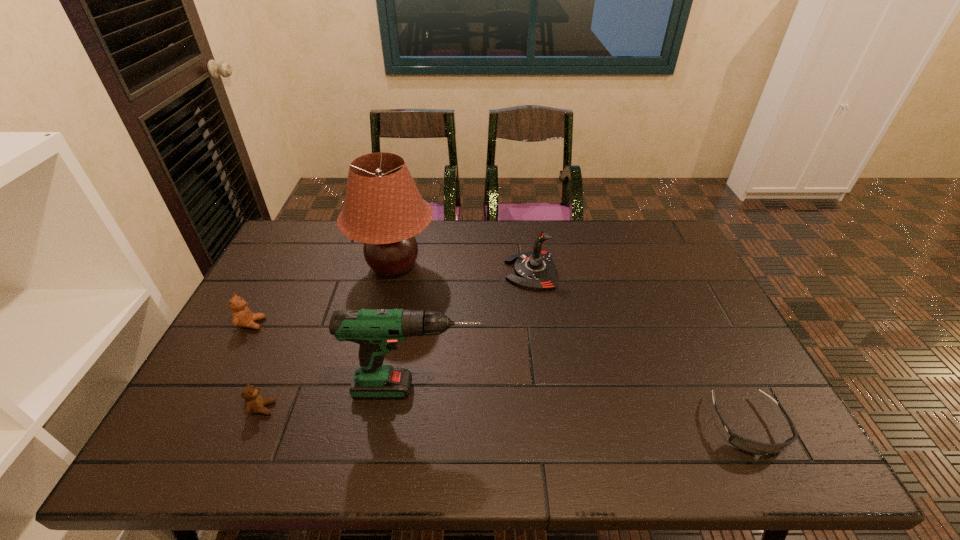
I want to click on object located in the right edge section of the desktop, so click(749, 446).

Where is `object that is at the near right corner`? The image size is (960, 540). object that is at the near right corner is located at coordinates (749, 446).

Locate an element on the screen. free space at the far edge of the desktop is located at coordinates (444, 227).

You are a GUI agent. You are given a task and a screenshot of the screen. Output one action in this format:
    pyautogui.click(x=<x>, y=<y>)
    Task: Click on the free space at the near edge
    
    Given the screenshot: What is the action you would take?
    pyautogui.click(x=619, y=431)

This screenshot has height=540, width=960. I want to click on vacant position at the left edge of the desktop, so click(251, 353).

This screenshot has height=540, width=960. In the image, there is a desktop. Find the location of `vacant space at the right edge`. vacant space at the right edge is located at coordinates (678, 309).

This screenshot has width=960, height=540. Find the location of `vacant space at the far right corner of the desktop`. vacant space at the far right corner of the desktop is located at coordinates (630, 225).

At what (x,y) coordinates should I click in order to perform the action: click on empty space that is in between the shortest object and the joystick. Please return your answer as a coordinate pair (x, y). This screenshot has width=960, height=540. Looking at the image, I should click on (639, 348).

This screenshot has height=540, width=960. I want to click on vacant area between the fourth tallest object and the second object from left to right, so (257, 366).

At what (x,y) coordinates should I click in order to perform the action: click on unoccupied position between the lampshade and the fifth object from left to right. Please return your answer as a coordinate pair (x, y). The width and height of the screenshot is (960, 540). Looking at the image, I should click on (463, 269).